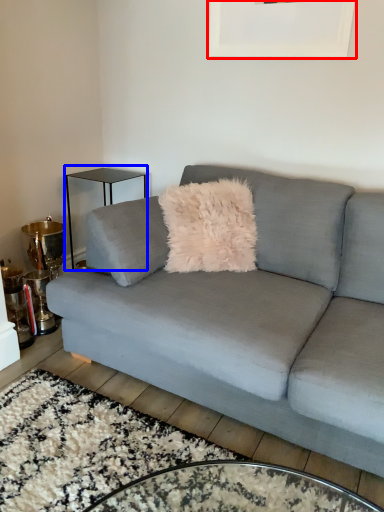
Question: Among these objects, which one is nearest to the camera, picture frame (highlighted by a red box) or table (highlighted by a blue box)?

Choices:
 (A) picture frame
 (B) table

Answer: (A)